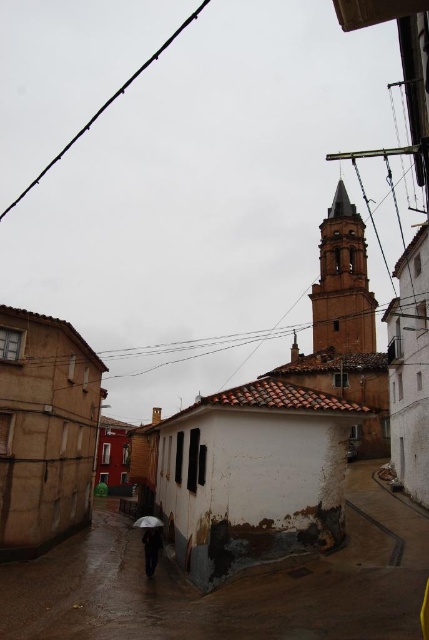
Question: Does dark fabric umbrella at lower center have a smaller size compared to white matte umbrella at lower center?

Choices:
 (A) yes
 (B) no

Answer: (A)

Question: From the image, what is the correct spatial relationship of dark fabric umbrella at lower center in relation to white matte umbrella at lower center?

Choices:
 (A) below
 (B) above

Answer: (B)

Question: Considering the real-world distances, which object is farthest from the rusty concrete alley at lower center?

Choices:
 (A) white matte umbrella at lower center
 (B) dark fabric umbrella at lower center

Answer: (A)

Question: Considering the real-world distances, which object is farthest from the white matte umbrella at lower center?

Choices:
 (A) rusty concrete alley at lower center
 (B) dark fabric umbrella at lower center

Answer: (A)

Question: Is rusty concrete alley at lower center wider than dark fabric umbrella at lower center?

Choices:
 (A) no
 (B) yes

Answer: (B)

Question: Which of the following is the closest to the observer?

Choices:
 (A) white matte umbrella at lower center
 (B) dark fabric umbrella at lower center

Answer: (B)